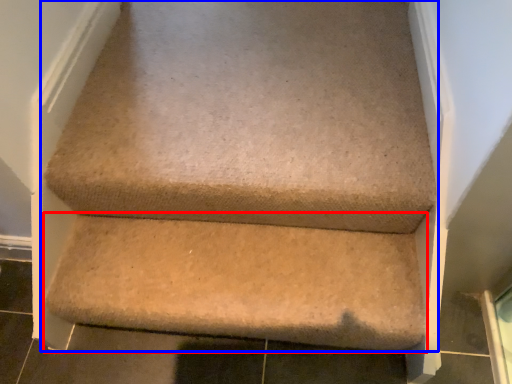
Question: Which of the following is the closest to the observer, stairwell (highlighted by a red box) or furniture (highlighted by a blue box)?

Choices:
 (A) stairwell
 (B) furniture

Answer: (B)